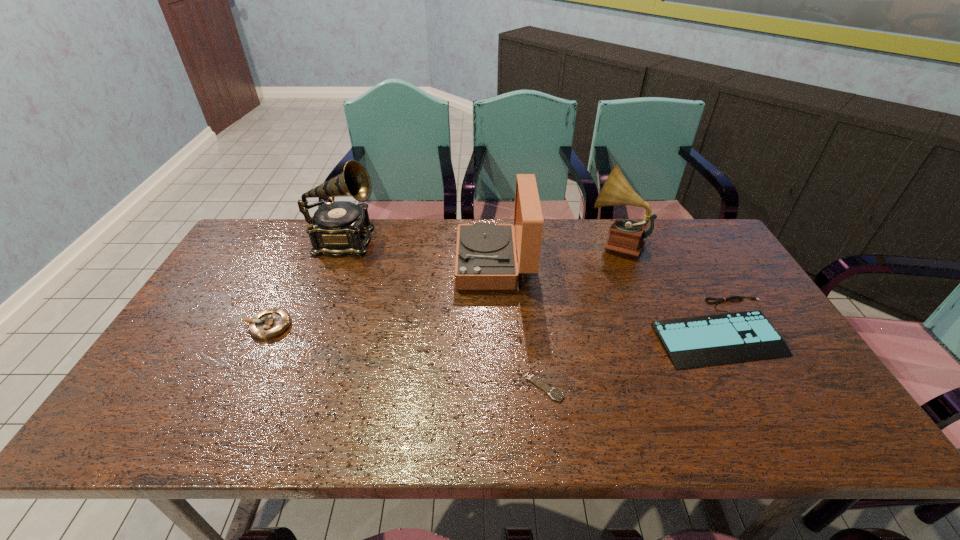
Find the location of a particular element. The height and width of the screenshot is (540, 960). free point located 0.260m on the horn of the rightmost phonograph record is located at coordinates (508, 242).

At what (x,y) coordinates should I click in order to perform the action: click on vacant space situated on the face of the second phonograph record from left to right. Please return your answer as a coordinate pair (x, y). This screenshot has height=540, width=960. Looking at the image, I should click on (383, 264).

You are a GUI agent. You are given a task and a screenshot of the screen. Output one action in this format:
    pyautogui.click(x=<x>, y=<y>)
    Task: Click on the free spot located 0.050m on the face of the second phonograph record from left to right
    
    Given the screenshot: What is the action you would take?
    pyautogui.click(x=441, y=264)

Where is `blank area located on the face of the second phonograph record from left to right`? This screenshot has height=540, width=960. blank area located on the face of the second phonograph record from left to right is located at coordinates (406, 264).

Locate an element on the screen. vacant space located on the front of the fourth tallest object is located at coordinates (221, 424).

Where is `free space located on the back of the computer keyboard`? Image resolution: width=960 pixels, height=540 pixels. free space located on the back of the computer keyboard is located at coordinates (689, 281).

Find the location of `free space located 0.110m on the back of the shortest object`. free space located 0.110m on the back of the shortest object is located at coordinates (538, 338).

The width and height of the screenshot is (960, 540). I want to click on object that is positioned at the right edge, so click(x=691, y=342).

Locate an element on the screen. The width and height of the screenshot is (960, 540). vacant space at the far edge is located at coordinates (557, 244).

This screenshot has height=540, width=960. What are the coordinates of `blank space at the near edge` in the screenshot? It's located at point(627,427).